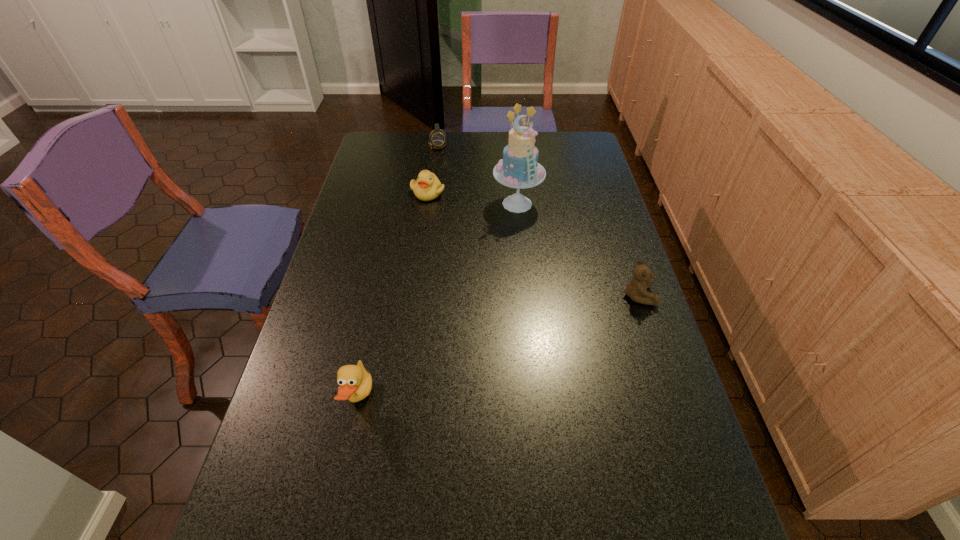
Locate an element on the screen. This screenshot has width=960, height=540. object that is at the right edge is located at coordinates (636, 289).

In the image, there is a desktop. At what (x,y) coordinates should I click in order to perform the action: click on vacant area at the far edge. Please return your answer as a coordinate pair (x, y). Looking at the image, I should click on (446, 153).

The height and width of the screenshot is (540, 960). In the image, there is a desktop. Find the location of `vacant space at the left edge`. vacant space at the left edge is located at coordinates (359, 255).

You are a GUI agent. You are given a task and a screenshot of the screen. Output one action in this format:
    pyautogui.click(x=<x>, y=<y>)
    Task: Click on the vacant region at the right edge of the desktop
    This screenshot has height=540, width=960.
    Given the screenshot: What is the action you would take?
    pyautogui.click(x=630, y=306)

Where is `free spot between the duckling and the cake`? The height and width of the screenshot is (540, 960). free spot between the duckling and the cake is located at coordinates (472, 198).

The image size is (960, 540). Identify the location of vacant area that lies between the rightmost object and the cake. (578, 249).

This screenshot has height=540, width=960. I want to click on free space that is in between the nearest object and the duckling, so click(394, 296).

In order to click on vacant area that lies between the teddy bear and the fourth object from left to right in this screenshot , I will do `click(578, 249)`.

Where is `free point between the compass and the leftmost object`? free point between the compass and the leftmost object is located at coordinates [398, 272].

Identify the location of free spot between the duckling and the rightmost object. 533,244.